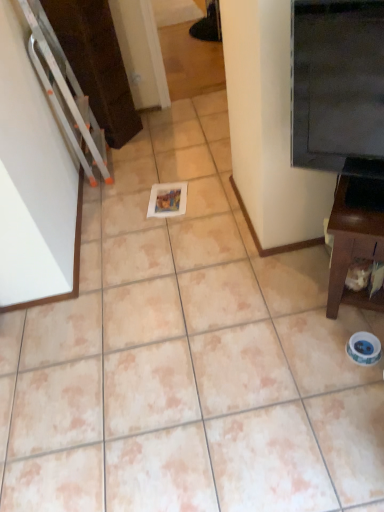
You are a GUI agent. You are given a task and a screenshot of the screen. Output one action in this format:
    pyautogui.click(x=<x>, y=<y>)
    Task: Click on the vacant space to the left of brown wood tv stand at right
    The height and width of the screenshot is (512, 384).
    Given the screenshot: What is the action you would take?
    tap(282, 304)